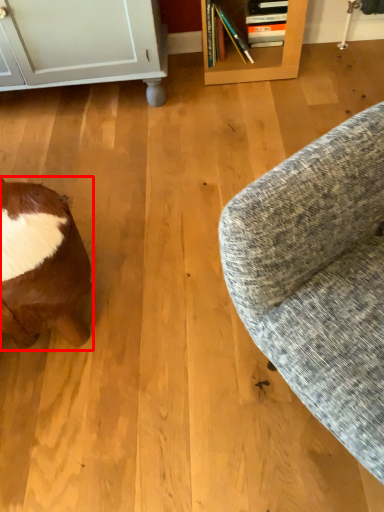
Question: From the image's perspective, where is animal (annotated by the red box) located relative to studio couch?

Choices:
 (A) above
 (B) below

Answer: (B)